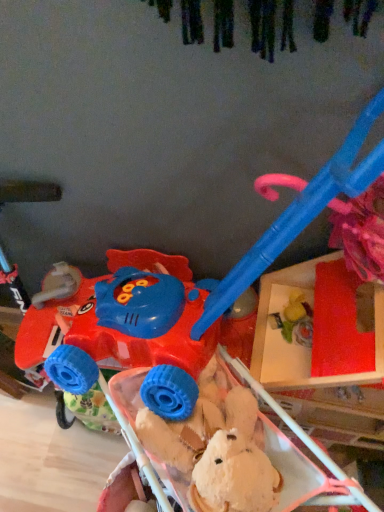
Where is `translucent plastic baby carriage at center`? This screenshot has height=512, width=384. translucent plastic baby carriage at center is located at coordinates (x=229, y=448).

Image resolution: width=384 pixels, height=512 pixels. What do you see at coordinates (229, 448) in the screenshot?
I see `translucent plastic baby carriage at center` at bounding box center [229, 448].

The height and width of the screenshot is (512, 384). What are the coordinates of `translucent plastic baby carriage at center` in the screenshot? It's located at (229, 448).